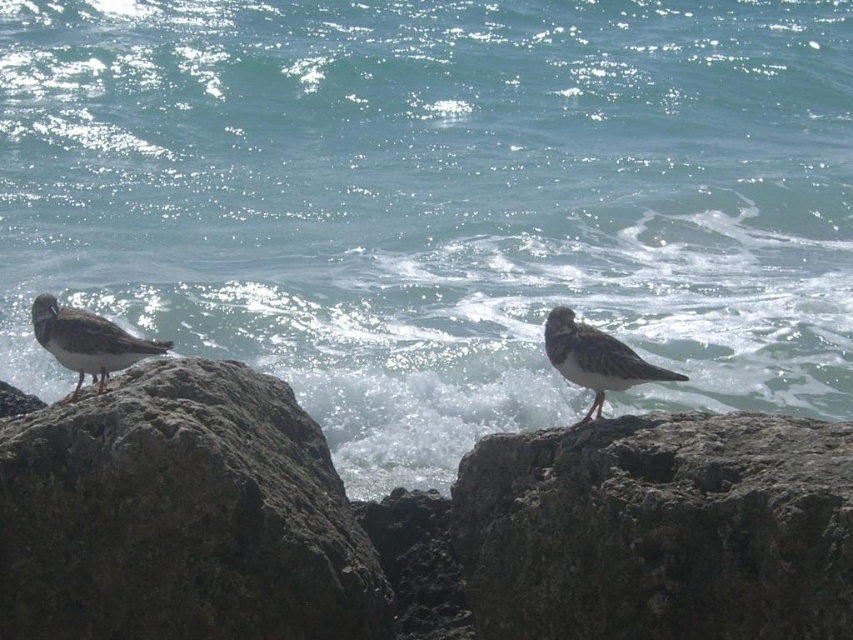
Can you confirm if gray rough rock at center is positioned to the right of gray matte bird at center?

In fact, gray rough rock at center is to the left of gray matte bird at center.

The height and width of the screenshot is (640, 853). I want to click on gray rough rock at center, so (183, 516).

Between gray rough rock at center and speckled gray bird at left, which one has less height?

speckled gray bird at left is shorter.

Between point (3, 448) and point (42, 310), which one is positioned in front?

Positioned in front is point (3, 448).

The image size is (853, 640). I want to click on gray rough rock at center, so click(183, 516).

Who is higher up, rough textured rock at center or gray matte bird at center?

gray matte bird at center is higher up.

In the scene shown: Who is more distant from viewer, (x=726, y=461) or (x=595, y=368)?

The point (x=595, y=368) is behind.

Find the location of `rough textured rock at center`. rough textured rock at center is located at coordinates (659, 529).